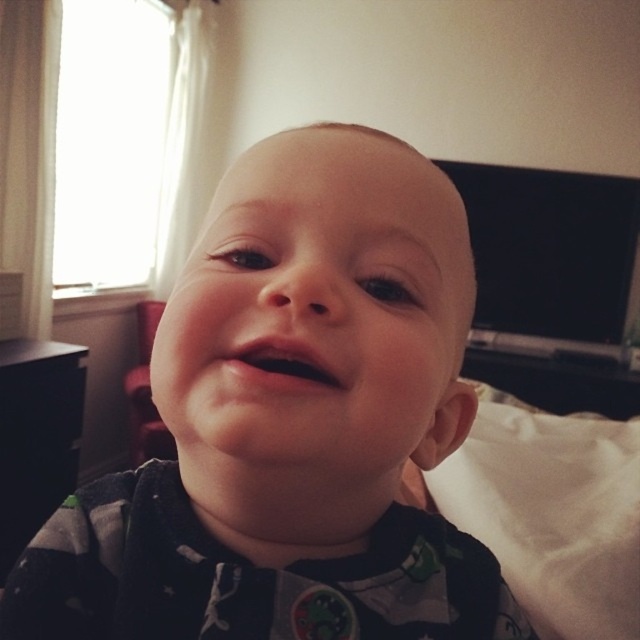
Question: Which point is closer to the camera?

Choices:
 (A) (168, 412)
 (B) (490, 502)

Answer: (A)

Question: Which point appears closest to the camera in this image?

Choices:
 (A) (506, 474)
 (B) (298, 605)

Answer: (B)

Question: Where is soft gray fabric at center located in relation to white soft pillow at lower right in the image?

Choices:
 (A) right
 (B) left

Answer: (B)

Question: Does soft gray fabric at center lie in front of white soft pillow at lower right?

Choices:
 (A) yes
 (B) no

Answer: (A)

Question: Can you confirm if soft gray fabric at center is positioned to the right of white soft pillow at lower right?

Choices:
 (A) no
 (B) yes

Answer: (A)